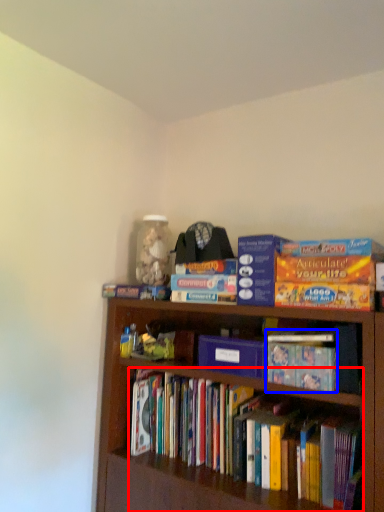
Question: Which object appears farthest to the camera in this image, book (highlighted by a red box) or book (highlighted by a blue box)?

Choices:
 (A) book
 (B) book

Answer: (B)